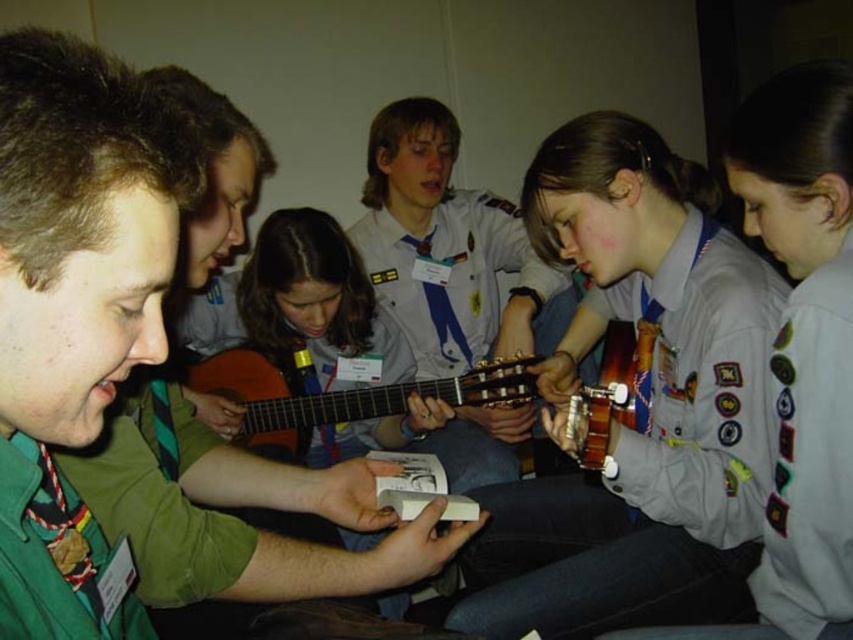
You are a member of the group and need to determine which object is taller between the matte gray uniform at center and the wooden acoustic guitar at center. Based on the scene, which one is taller?

The matte gray uniform at center is taller than the wooden acoustic guitar at center according to the description.

You are part of the scout group and need to pass a note to the person in the matte gray uniform at center. The green uniform shirt at center is blocking your path. Can you go around them?

The green uniform shirt at center is in front of the matte gray uniform at center, so you can go around the green uniform shirt at center to reach the matte gray uniform at center.